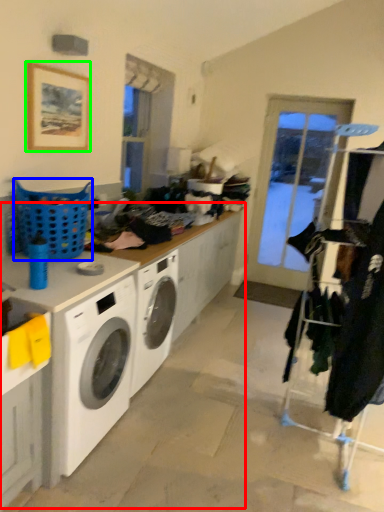
Question: Estimate the real-world distances between objects in this image. Which object is farther from counter top (highlighted by a red box), basket (highlighted by a blue box) or picture frame (highlighted by a green box)?

Choices:
 (A) basket
 (B) picture frame

Answer: (B)